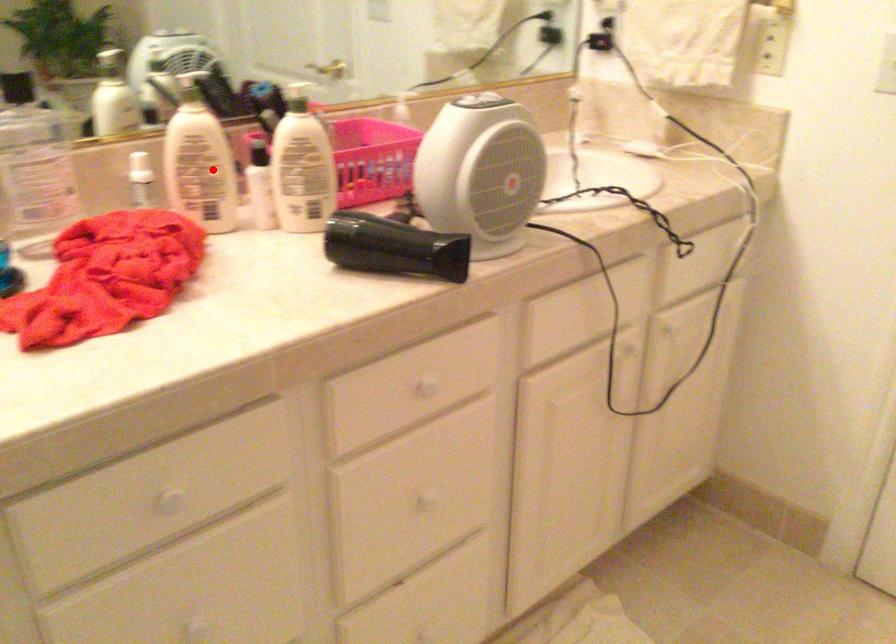
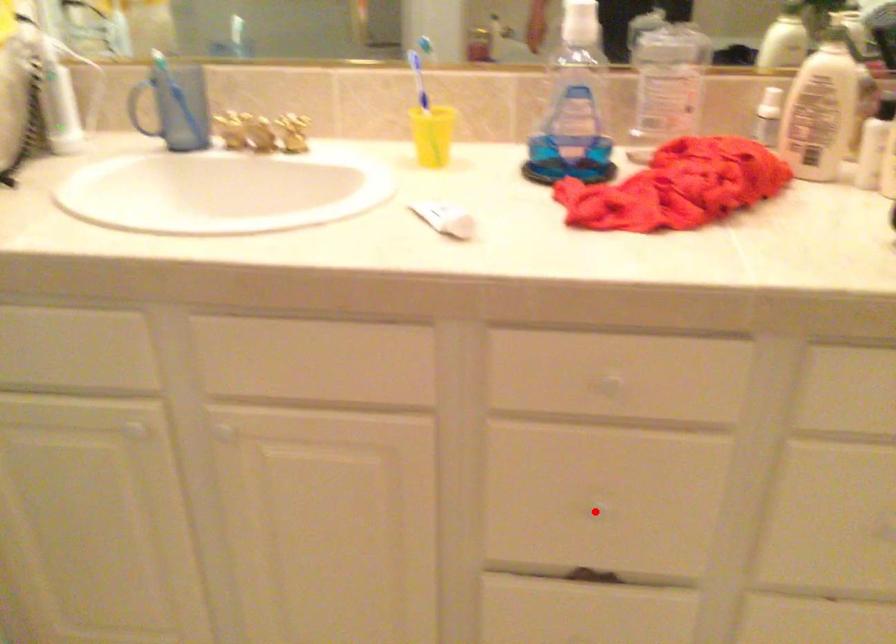
Based on the photo, I am providing you with two images of the same scene from different viewpoints. A red point is marked on the first image and another point is marked on the second image. Is the marked point in image1 the same physical position as the marked point in image2?

No